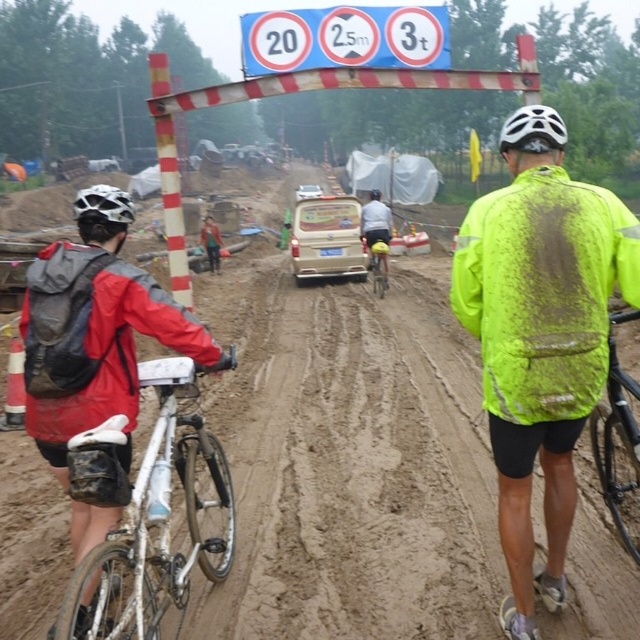
You are a photographer standing at the camera position. You want to place a small flag at point (97, 493) to mark the starting line. If your flag pole is 2 meters long, will it reach the point from where you are standing?

The distance between the camera and point (97, 493) is 2.52 meters, so the flag pole of 2 meters is too short to reach the point from the camera position.

Consider the image. You are a photographer at the muddy off road cycling event. You want to capture a photo of the black matte mountain bike at center. Where should you position your camera to ensure it is centered in the frame?

To center the black matte mountain bike at center in the frame, position the camera at point coordinates approximately at the center of the bike, which is located at point coordinates [618,445].